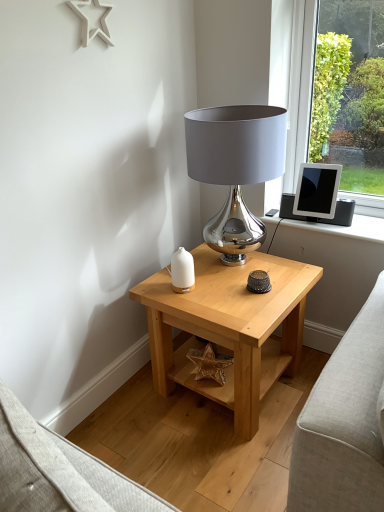
Question: From the image's perspective, is shiny metallic lamp at upper center located beneath natural wood side table at center?

Choices:
 (A) yes
 (B) no

Answer: (B)

Question: Does shiny metallic lamp at upper center have a greater height compared to natural wood side table at center?

Choices:
 (A) no
 (B) yes

Answer: (B)

Question: Is shiny metallic lamp at upper center smaller than natural wood side table at center?

Choices:
 (A) yes
 (B) no

Answer: (A)

Question: Can you see shiny metallic lamp at upper center touching natural wood side table at center?

Choices:
 (A) yes
 (B) no

Answer: (B)

Question: From a real-world perspective, is shiny metallic lamp at upper center positioned under natural wood side table at center based on gravity?

Choices:
 (A) no
 (B) yes

Answer: (A)

Question: In terms of width, does shiny metallic lamp at upper center look wider or thinner when compared to natural wood side table at center?

Choices:
 (A) wide
 (B) thin

Answer: (B)

Question: Is shiny metallic lamp at upper center in front of or behind natural wood side table at center in the image?

Choices:
 (A) behind
 (B) front

Answer: (A)

Question: Is point (228, 129) positioned closer to the camera than point (144, 287)?

Choices:
 (A) closer
 (B) farther

Answer: (A)

Question: Would you say shiny metallic lamp at upper center is inside or outside natural wood side table at center?

Choices:
 (A) outside
 (B) inside

Answer: (A)

Question: Based on their sizes in the image, would you say shiny metallic lamp at upper center is bigger or smaller than silver metallic tablet at upper right?

Choices:
 (A) small
 (B) big

Answer: (B)

Question: From a real-world perspective, is shiny metallic lamp at upper center above or below silver metallic tablet at upper right?

Choices:
 (A) below
 (B) above

Answer: (B)

Question: From the image's perspective, is shiny metallic lamp at upper center above or below silver metallic tablet at upper right?

Choices:
 (A) above
 (B) below

Answer: (B)

Question: Would you say shiny metallic lamp at upper center is inside or outside silver metallic tablet at upper right?

Choices:
 (A) outside
 (B) inside

Answer: (A)

Question: Would you say natural wood side table at center is inside or outside white glossy vase at center?

Choices:
 (A) inside
 (B) outside

Answer: (B)

Question: In terms of height, does natural wood side table at center look taller or shorter compared to white glossy vase at center?

Choices:
 (A) short
 (B) tall

Answer: (B)